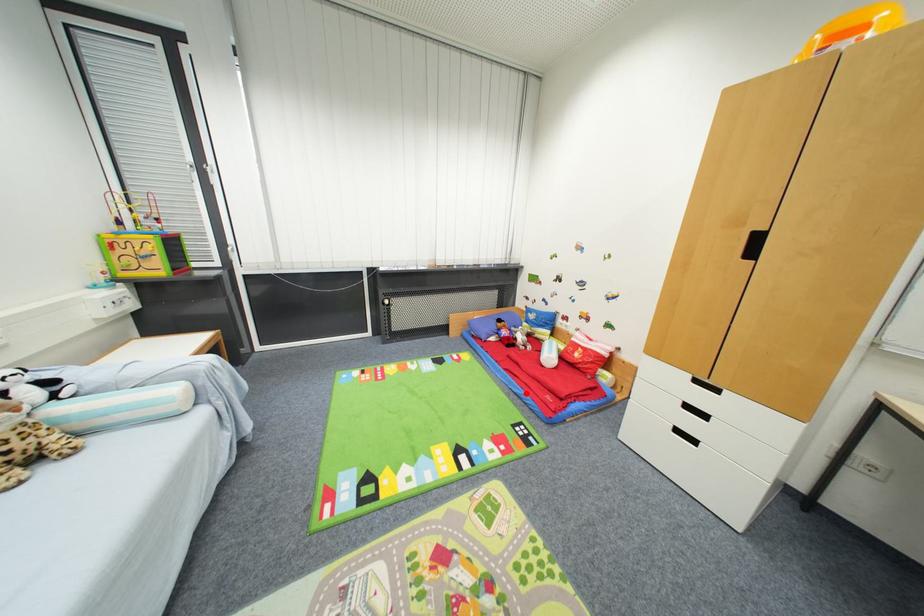
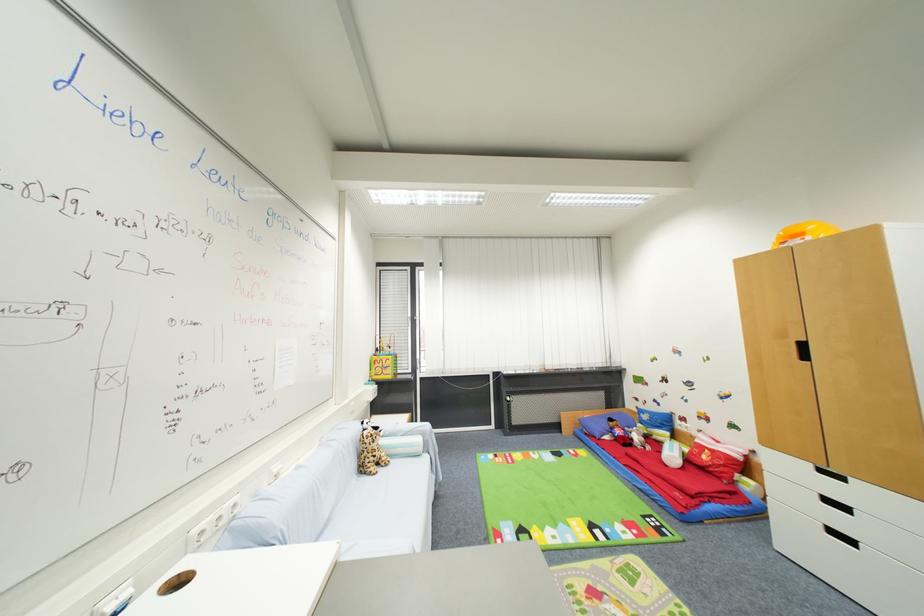
In the second image, find the point that corresponds to the highlighted location in the first image.

(650, 488)